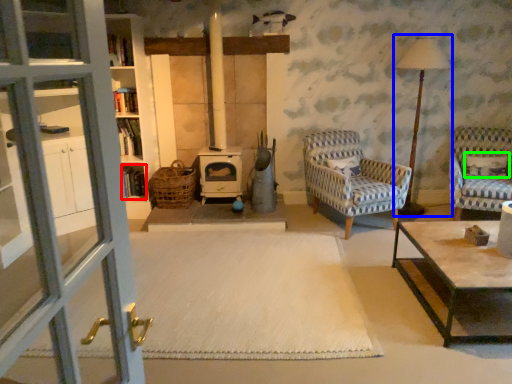
Question: Estimate the real-world distances between objects in this image. Which object is farther from shelf (highlighted by a red box), table lamp (highlighted by a blue box) or pillow (highlighted by a green box)?

Choices:
 (A) table lamp
 (B) pillow

Answer: (B)